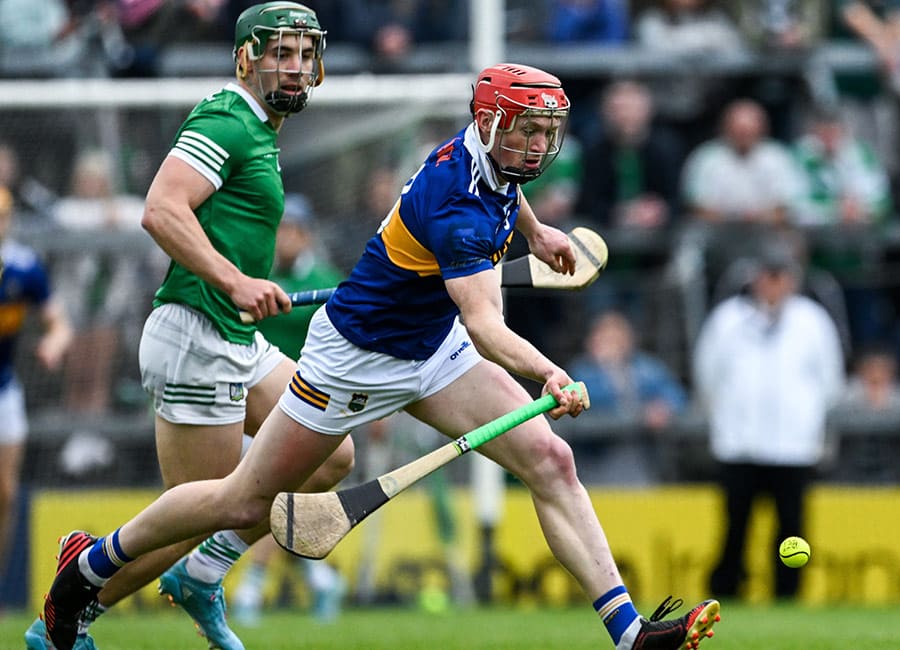
You are a GUI agent. You are given a task and a screenshot of the screen. Output one action in this format:
    pyautogui.click(x=<x>, y=<y>)
    Task: Click on the wall
    The image size is (900, 650).
    Given the screenshot: What is the action you would take?
    pyautogui.click(x=617, y=522)